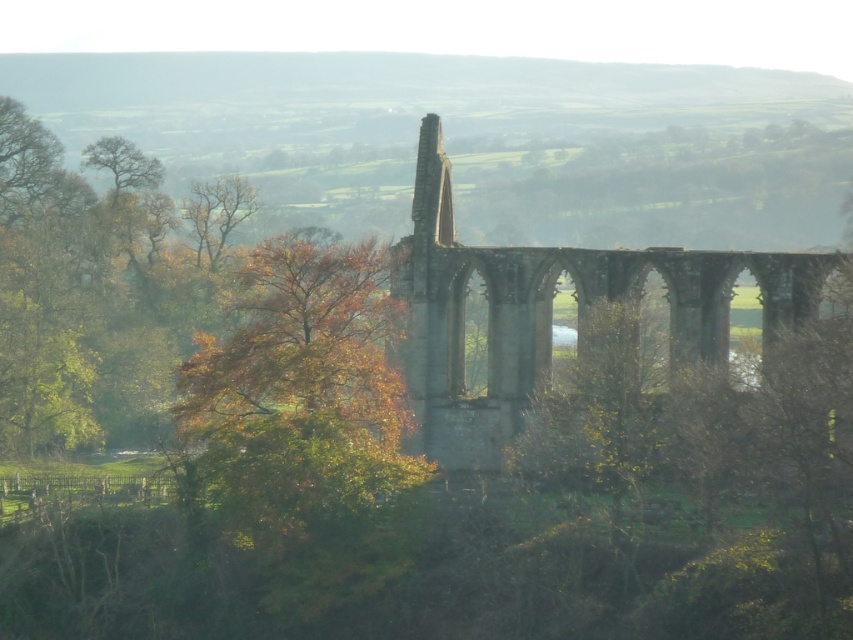
Where is `autumn leaves at left`? This screenshot has height=640, width=853. autumn leaves at left is located at coordinates (296, 396).

Which is more to the left, autumn leaves at left or stone arches at center?

From the viewer's perspective, autumn leaves at left appears more on the left side.

This screenshot has width=853, height=640. What do you see at coordinates (296, 396) in the screenshot? I see `autumn leaves at left` at bounding box center [296, 396].

Identify the location of autumn leaves at left. click(x=296, y=396).